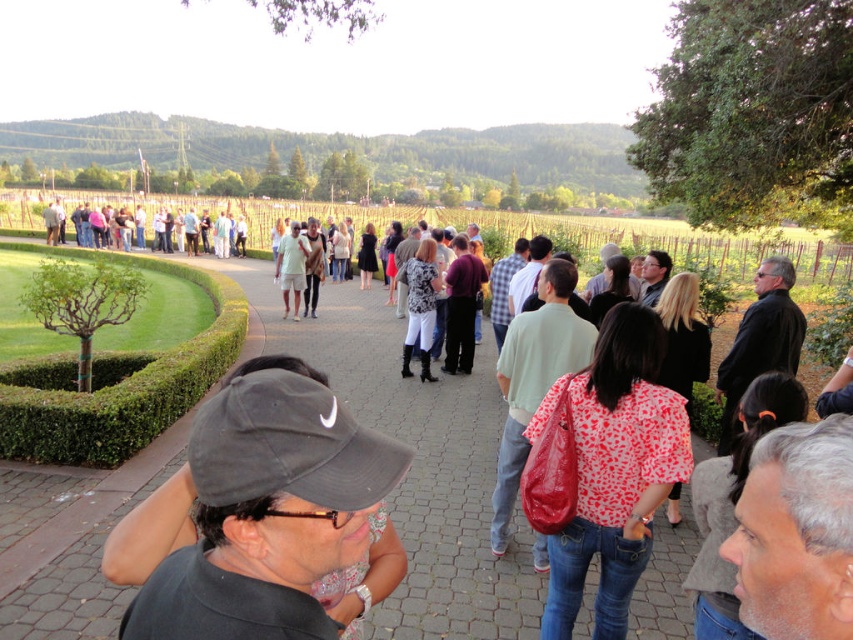
Who is more distant from viewer, (614, 499) or (25, 392)?

Positioned behind is point (25, 392).

Is red fabric bag at center to the left of green leafy hedge at lower left from the viewer's perspective?

Incorrect, red fabric bag at center is not on the left side of green leafy hedge at lower left.

What do you see at coordinates (613, 468) in the screenshot? The height and width of the screenshot is (640, 853). I see `red fabric bag at center` at bounding box center [613, 468].

In order to click on red fabric bag at center in this screenshot , I will do `click(613, 468)`.

Is green leafy hedge at lower left behind black fabric cap at center?

That is True.

Does green leafy hedge at lower left have a lesser width compared to black fabric cap at center?

No.

The width and height of the screenshot is (853, 640). What are the coordinates of `green leafy hedge at lower left` in the screenshot? It's located at (119, 387).

Does red fabric bag at center have a smaller size compared to matte black jacket at center?

Indeed, red fabric bag at center has a smaller size compared to matte black jacket at center.

Which is more to the right, red fabric bag at center or matte black jacket at center?

red fabric bag at center is more to the right.

Does point (628, 413) come farther from viewer compared to point (151, 221)?

That is False.

Image resolution: width=853 pixels, height=640 pixels. In order to click on red fabric bag at center in this screenshot , I will do coord(613,468).